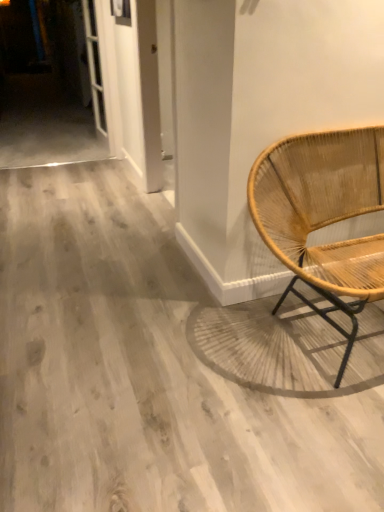
Where is `free space that is to the left of brown wicker chair at right`? Image resolution: width=384 pixels, height=512 pixels. free space that is to the left of brown wicker chair at right is located at coordinates (169, 348).